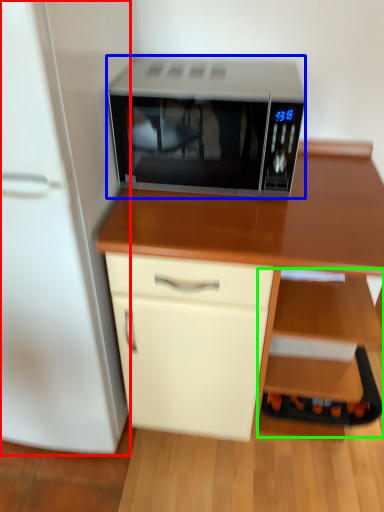
Question: Based on their relative distances, which object is nearer to refrigerator (highlighted by a red box)? Choose from microwave oven (highlighted by a blue box) and shelf (highlighted by a green box).

Choices:
 (A) microwave oven
 (B) shelf

Answer: (A)